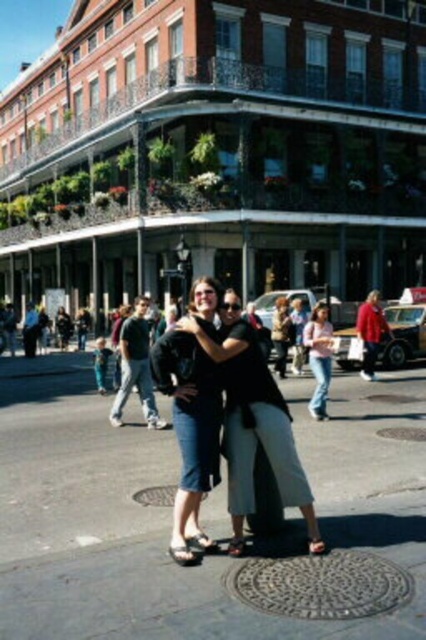
Question: Is black fabric couple at center above denim pants at center?

Choices:
 (A) yes
 (B) no

Answer: (A)

Question: Which point is farther to the camera?

Choices:
 (A) (327, 326)
 (B) (138, 308)

Answer: (B)

Question: Which object is closer to the camera taking this photo?

Choices:
 (A) pink fabric shirt at right
 (B) black fabric couple at center

Answer: (B)

Question: Which object appears farthest from the camera in this image?

Choices:
 (A) pink fabric shirt at right
 (B) denim pants at center
 (C) black fabric couple at center

Answer: (A)

Question: Does denim pants at center appear on the right side of dark gray jeans at center?

Choices:
 (A) yes
 (B) no

Answer: (A)

Question: Is black fabric couple at center above dark gray jeans at center?

Choices:
 (A) no
 (B) yes

Answer: (B)